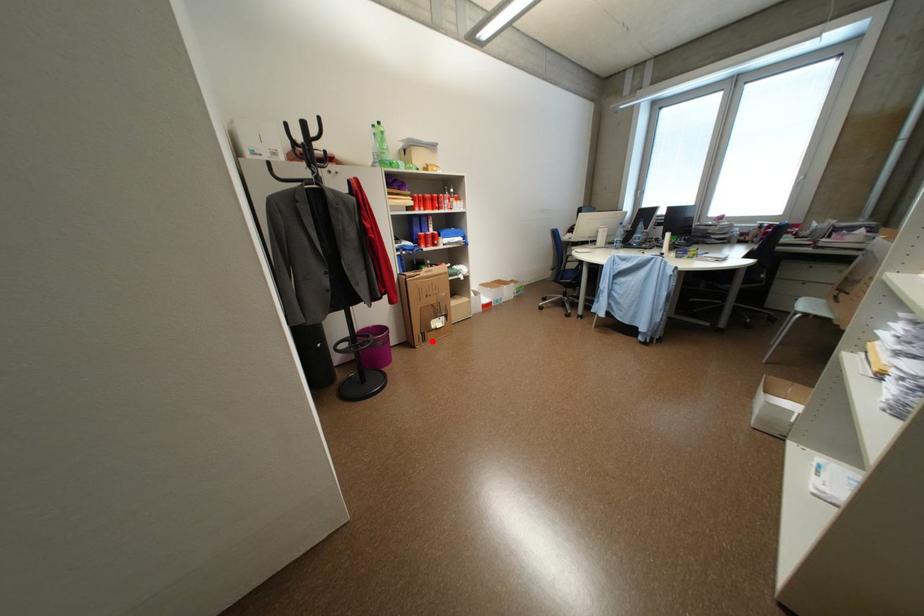
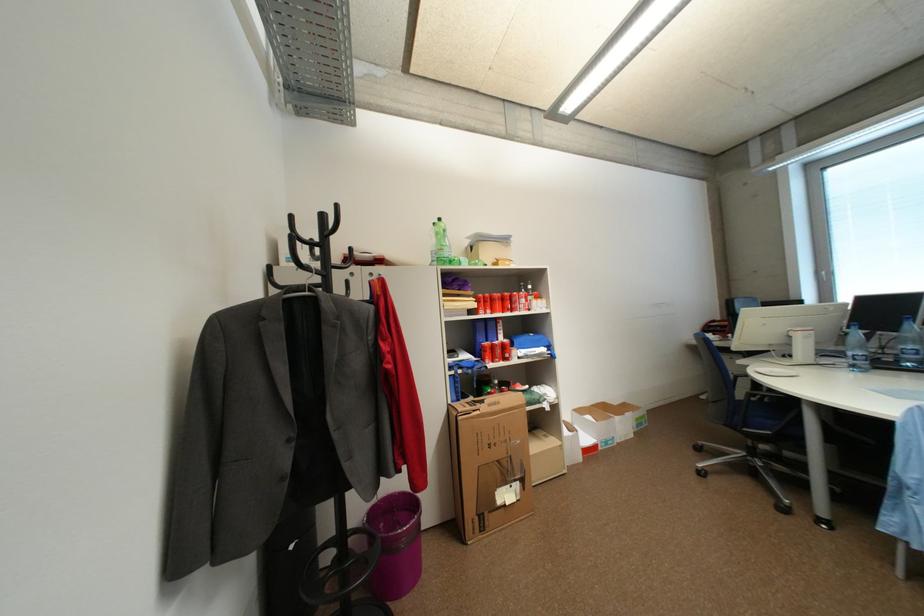
Find the pixel in the second image that matches the highlighted location in the first image.

(491, 529)